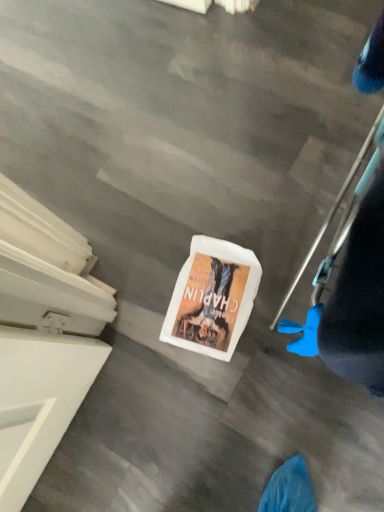
In order to click on free space above white matte book at center (from a real-world perspective) in this screenshot , I will do `click(210, 294)`.